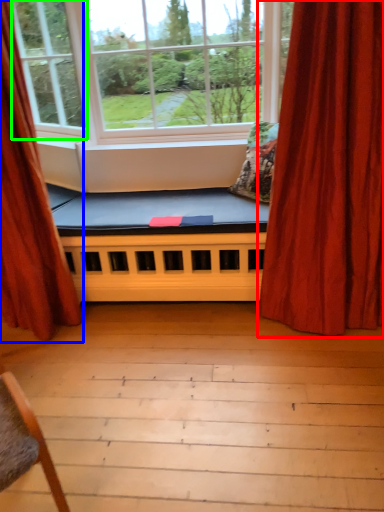
Question: Which is farther away from curtain (highlighted by a red box)? curtain (highlighted by a blue box) or window (highlighted by a green box)?

Choices:
 (A) curtain
 (B) window

Answer: (B)